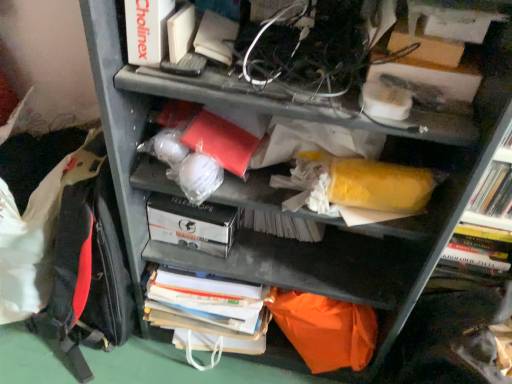
Image resolution: width=512 pixels, height=384 pixels. What are the coordinates of `yellow matte bookshelf at right` in the screenshot? It's located at (486, 219).

Locate an element on the screen. The width and height of the screenshot is (512, 384). white matte book at upper left, which is the 1th paperback book from top to bottom is located at coordinates (147, 30).

This screenshot has width=512, height=384. What do you see at coordinates (87, 262) in the screenshot?
I see `red fabric backpack at left` at bounding box center [87, 262].

Locate an element on the screen. The height and width of the screenshot is (384, 512). yellow matte bookshelf at right is located at coordinates (486, 219).

From the image's perspective, is red fabric backpack at left under white cardboard box at center, acting as the first paperback book starting from the back?

Incorrect, from the image's perspective, red fabric backpack at left is higher than white cardboard box at center, acting as the first paperback book starting from the back.

Is red fabric backpack at left wider or thinner than white cardboard box at center, the 2th paperback book in the front-to-back sequence?

Considering their sizes, red fabric backpack at left looks broader than white cardboard box at center, the 2th paperback book in the front-to-back sequence.

Is red fabric backpack at left smaller than white cardboard box at center, marked as the first paperback book in a bottom-to-top arrangement?

No, red fabric backpack at left is not smaller than white cardboard box at center, marked as the first paperback book in a bottom-to-top arrangement.

Is white cardboard box at center, marked as the first paperback book in a bottom-to-top arrangement, positioned with its back to yellow matte bookshelf at right?

That's not correct — white cardboard box at center, marked as the first paperback book in a bottom-to-top arrangement, is not looking away from yellow matte bookshelf at right.

From a real-world perspective, which is physically above, white cardboard box at center, marked as the first paperback book in a bottom-to-top arrangement, or yellow matte bookshelf at right?

yellow matte bookshelf at right is physically above.

Which is nearer, (156, 203) or (497, 267)?

Point (156, 203).

From the picture: How far apart are yellow matte bookshelf at right and red fabric backpack at left?

The distance of yellow matte bookshelf at right from red fabric backpack at left is 74.92 centimeters.

Is yellow matte bookshelf at right facing away from red fabric backpack at left?

No, yellow matte bookshelf at right's orientation is not away from red fabric backpack at left.

Are yellow matte bookshelf at right and red fabric backpack at left located far from each other?

No, yellow matte bookshelf at right is not far from red fabric backpack at left.

Which object is further away from the camera, yellow matte bookshelf at right or white matte book at upper left, which is counted as the 2th paperback book, starting from the back?

Positioned behind is yellow matte bookshelf at right.

Considering the sizes of objects yellow matte bookshelf at right and white matte book at upper left, which is counted as the 2th paperback book, starting from the back, in the image provided, who is shorter, yellow matte bookshelf at right or white matte book at upper left, which is counted as the 2th paperback book, starting from the back,?

white matte book at upper left, which is counted as the 2th paperback book, starting from the back.

Is point (478, 268) closer or farther from the camera than point (143, 8)?

Point (478, 268) is farther from the camera than point (143, 8).

Is yellow matte bookshelf at right turned away from white matte book at upper left, which is counted as the 2th paperback book, starting from the back?

No, white matte book at upper left, which is counted as the 2th paperback book, starting from the back, is not at the back of yellow matte bookshelf at right.

What are the coordinates of `backpack in front of the white cardboard box at center, marked as the first paperback book in a bottom-to-top arrangement` in the screenshot? It's located at 87,262.

Can we say white cardboard box at center, marked as the first paperback book in a bottom-to-top arrangement, lies outside red fabric backpack at left?

Yes, white cardboard box at center, marked as the first paperback book in a bottom-to-top arrangement, is not within red fabric backpack at left.

From the image's perspective, which one is positioned lower, white cardboard box at center, marked as the first paperback book in a bottom-to-top arrangement, or red fabric backpack at left?

white cardboard box at center, marked as the first paperback book in a bottom-to-top arrangement, from the image's perspective.

Considering the relative sizes of white cardboard box at center, the 2th paperback book in the front-to-back sequence, and red fabric backpack at left in the image provided, is white cardboard box at center, the 2th paperback book in the front-to-back sequence, thinner than red fabric backpack at left?

Indeed, white cardboard box at center, the 2th paperback book in the front-to-back sequence, has a lesser width compared to red fabric backpack at left.

Considering the positions of point (181, 216) and point (149, 25), is point (181, 216) closer or farther from the camera than point (149, 25)?

Point (181, 216) appears to be farther away from the viewer than point (149, 25).

Is white matte book at upper left, which is the 1th paperback book from top to bottom, a part of white cardboard box at center, the 2th paperback book in the front-to-back sequence?

No, white matte book at upper left, which is the 1th paperback book from top to bottom, is not a part of white cardboard box at center, the 2th paperback book in the front-to-back sequence.

From a real-world perspective, is white cardboard box at center, acting as the first paperback book starting from the back, under white matte book at upper left, which is the 1th paperback book from top to bottom?

Correct, in the physical world, white cardboard box at center, acting as the first paperback book starting from the back, is lower than white matte book at upper left, which is the 1th paperback book from top to bottom.

Does point (154, 25) come closer to viewer compared to point (503, 185)?

Yes, it is in front of point (503, 185).

Is yellow matte bookshelf at right at the back of white matte book at upper left, which is the 1th paperback book from top to bottom?

That's not correct — white matte book at upper left, which is the 1th paperback book from top to bottom, is not looking away from yellow matte bookshelf at right.

Which object is thinner, white matte book at upper left, which is counted as the 2th paperback book, starting from the back, or yellow matte bookshelf at right?

yellow matte bookshelf at right.

Which of these two, white matte book at upper left, the 1th paperback book in the front-to-back sequence, or yellow matte bookshelf at right, stands taller?

yellow matte bookshelf at right is taller.

Where is `paperback book lying behind the red fabric backpack at left`? The width and height of the screenshot is (512, 384). paperback book lying behind the red fabric backpack at left is located at coordinates (192, 223).

I want to click on shelf located in front of the white cardboard box at center, acting as the first paperback book starting from the back, so click(486, 219).

From the image, which object appears to be nearer to white cardboard box at center, marked as the first paperback book in a bottom-to-top arrangement, yellow matte bookshelf at right or white matte book at upper left, positioned as the second paperback book in bottom-to-top order?

white matte book at upper left, positioned as the second paperback book in bottom-to-top order.

Estimate the real-world distances between objects in this image. Which object is closer to white matte book at upper left, positioned as the second paperback book in bottom-to-top order, red fabric backpack at left or white cardboard box at center, the 2th paperback book in the front-to-back sequence?

white cardboard box at center, the 2th paperback book in the front-to-back sequence, is positioned closer to the anchor white matte book at upper left, positioned as the second paperback book in bottom-to-top order.

In the scene shown: Looking at the image, which one is located further to white matte book at upper left, which is the 1th paperback book from top to bottom, yellow matte bookshelf at right or red fabric backpack at left?

yellow matte bookshelf at right is further to white matte book at upper left, which is the 1th paperback book from top to bottom.

Which object lies further to the anchor point white matte book at upper left, the 1th paperback book in the front-to-back sequence, white cardboard box at center, the 2th paperback book in the front-to-back sequence, or red fabric backpack at left?

red fabric backpack at left is further to white matte book at upper left, the 1th paperback book in the front-to-back sequence.

From the image, which object appears to be farther from red fabric backpack at left, yellow matte bookshelf at right or white matte book at upper left, the 1th paperback book in the front-to-back sequence?

yellow matte bookshelf at right is further to red fabric backpack at left.

Considering their positions, is red fabric backpack at left positioned further to white cardboard box at center, marked as the first paperback book in a bottom-to-top arrangement, than yellow matte bookshelf at right?

yellow matte bookshelf at right is further to white cardboard box at center, marked as the first paperback book in a bottom-to-top arrangement.

From the image, which object appears to be farther from yellow matte bookshelf at right, white matte book at upper left, the 1th paperback book in the front-to-back sequence, or white cardboard box at center, marked as the first paperback book in a bottom-to-top arrangement?

white matte book at upper left, the 1th paperback book in the front-to-back sequence, lies further to yellow matte bookshelf at right than the other object.

Based on the photo, looking at the image, which one is located closer to red fabric backpack at left, white cardboard box at center, acting as the first paperback book starting from the back, or yellow matte bookshelf at right?

white cardboard box at center, acting as the first paperback book starting from the back, is positioned closer to the anchor red fabric backpack at left.

Identify the location of paperback book situated between white matte book at upper left, which is the 1th paperback book from top to bottom, and yellow matte bookshelf at right from left to right. The image size is (512, 384). (192, 223).

Locate an element on the screen. The height and width of the screenshot is (384, 512). paperback book between red fabric backpack at left and white cardboard box at center, acting as the first paperback book starting from the back, in the horizontal direction is located at coordinates (147, 30).